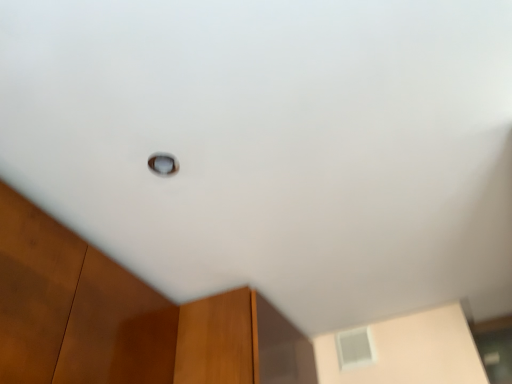
Image resolution: width=512 pixels, height=384 pixels. Identify the location of white frosted glass window at upper center, placed as the first window when sorted from bottom to top. (354, 348).

Describe the element at coordinates (354, 348) in the screenshot. The height and width of the screenshot is (384, 512). I see `white frosted glass window at upper center, the first window in the back-to-front sequence` at that location.

Find the location of a particular element. The image size is (512, 384). transparent glass window at center, the second window when ordered from bottom to top is located at coordinates (163, 164).

Describe the element at coordinates (163, 164) in the screenshot. This screenshot has width=512, height=384. I see `transparent glass window at center, arranged as the 1th window when viewed from the left` at that location.

This screenshot has height=384, width=512. I want to click on white frosted glass window at upper center, the first window in the back-to-front sequence, so click(x=354, y=348).

Can you confirm if white frosted glass window at upper center, the second window when ordered from front to back, is positioned to the left of transparent glass window at center, placed as the first window when sorted from top to bottom?

Incorrect, white frosted glass window at upper center, the second window when ordered from front to back, is not on the left side of transparent glass window at center, placed as the first window when sorted from top to bottom.

Considering the positions of objects white frosted glass window at upper center, the first window in the back-to-front sequence, and transparent glass window at center, which ranks as the second window in back-to-front order, in the image provided, who is behind, white frosted glass window at upper center, the first window in the back-to-front sequence, or transparent glass window at center, which ranks as the second window in back-to-front order,?

white frosted glass window at upper center, the first window in the back-to-front sequence, is further away from the camera.

Does point (358, 348) lie behind point (164, 157)?

Yes, it is.

From the image's perspective, which is above, white frosted glass window at upper center, the second window in the left-to-right sequence, or transparent glass window at center, which ranks as the second window in right-to-left order?

transparent glass window at center, which ranks as the second window in right-to-left order.

From a real-world perspective, is white frosted glass window at upper center, the second window when ordered from front to back, on transparent glass window at center, which ranks as the second window in back-to-front order?

Incorrect, from a real-world perspective, white frosted glass window at upper center, the second window when ordered from front to back, is lower than transparent glass window at center, which ranks as the second window in back-to-front order.

Which of these two, white frosted glass window at upper center, placed as the second window when sorted from top to bottom, or transparent glass window at center, which ranks as the second window in back-to-front order, is thinner?

transparent glass window at center, which ranks as the second window in back-to-front order, is thinner.

Who is shorter, white frosted glass window at upper center, the first window in the back-to-front sequence, or transparent glass window at center, the second window when ordered from bottom to top?

transparent glass window at center, the second window when ordered from bottom to top, is shorter.

Which of these two, white frosted glass window at upper center, the second window in the left-to-right sequence, or transparent glass window at center, which ranks as the second window in right-to-left order, is smaller?

transparent glass window at center, which ranks as the second window in right-to-left order, is smaller.

Is white frosted glass window at upper center, placed as the first window when sorted from bottom to top, positioned beyond the bounds of transparent glass window at center, which ranks as the second window in back-to-front order?

Indeed, white frosted glass window at upper center, placed as the first window when sorted from bottom to top, is completely outside transparent glass window at center, which ranks as the second window in back-to-front order.

Are white frosted glass window at upper center, the first window in the back-to-front sequence, and transparent glass window at center, arranged as the 1th window when viewed from the left, beside each other?

No, white frosted glass window at upper center, the first window in the back-to-front sequence, is not next to transparent glass window at center, arranged as the 1th window when viewed from the left.

Is transparent glass window at center, arranged as the 1th window when viewed from the left, at the back of white frosted glass window at upper center, acting as the first window starting from the right?

That's not correct — white frosted glass window at upper center, acting as the first window starting from the right, is not looking away from transparent glass window at center, arranged as the 1th window when viewed from the left.

How many degrees apart are the facing directions of white frosted glass window at upper center, the first window in the back-to-front sequence, and transparent glass window at center, which ranks as the second window in right-to-left order?

They differ by 1.97 degrees in their facing directions.

At what (x,y) coordinates should I click in order to perform the action: click on window lying above the white frosted glass window at upper center, placed as the first window when sorted from bottom to top (from the image's perspective). Please return your answer as a coordinate pair (x, y). The width and height of the screenshot is (512, 384). Looking at the image, I should click on (163, 164).

Considering the positions of objects transparent glass window at center, arranged as the 1th window when viewed from the left, and white frosted glass window at upper center, the second window in the left-to-right sequence, in the image provided, who is more to the left, transparent glass window at center, arranged as the 1th window when viewed from the left, or white frosted glass window at upper center, the second window in the left-to-right sequence,?

transparent glass window at center, arranged as the 1th window when viewed from the left, is more to the left.

Which object is closer to the camera taking this photo, transparent glass window at center, the second window when ordered from bottom to top, or white frosted glass window at upper center, placed as the first window when sorted from bottom to top?

transparent glass window at center, the second window when ordered from bottom to top, is in front.

Does point (162, 168) lie in front of point (362, 339)?

Yes, point (162, 168) is in front of point (362, 339).

From the image's perspective, which one is positioned higher, transparent glass window at center, arranged as the 1th window when viewed from the left, or white frosted glass window at upper center, placed as the first window when sorted from bottom to top?

transparent glass window at center, arranged as the 1th window when viewed from the left, from the image's perspective.

From a real-world perspective, which object stands above the other?

From a 3D spatial view, transparent glass window at center, which ranks as the second window in back-to-front order, is above.

Considering the sizes of transparent glass window at center, which ranks as the second window in back-to-front order, and white frosted glass window at upper center, placed as the second window when sorted from top to bottom, in the image, is transparent glass window at center, which ranks as the second window in back-to-front order, wider or thinner than white frosted glass window at upper center, placed as the second window when sorted from top to bottom,?

In the image, transparent glass window at center, which ranks as the second window in back-to-front order, appears to be more narrow than white frosted glass window at upper center, placed as the second window when sorted from top to bottom.

Between transparent glass window at center, arranged as the 1th window when viewed from the left, and white frosted glass window at upper center, the second window when ordered from front to back, which one has less height?

Standing shorter between the two is transparent glass window at center, arranged as the 1th window when viewed from the left.

Based on their sizes in the image, would you say transparent glass window at center, placed as the first window when sorted from top to bottom, is bigger or smaller than white frosted glass window at upper center, placed as the second window when sorted from top to bottom?

Clearly, transparent glass window at center, placed as the first window when sorted from top to bottom, is smaller in size than white frosted glass window at upper center, placed as the second window when sorted from top to bottom.

Is transparent glass window at center, which ranks as the second window in right-to-left order, outside of white frosted glass window at upper center, the first window in the back-to-front sequence?

That's correct, transparent glass window at center, which ranks as the second window in right-to-left order, is outside of white frosted glass window at upper center, the first window in the back-to-front sequence.

Is transparent glass window at center, which ranks as the second window in right-to-left order, next to white frosted glass window at upper center, acting as the first window starting from the right?

No, transparent glass window at center, which ranks as the second window in right-to-left order, is not in contact with white frosted glass window at upper center, acting as the first window starting from the right.

Is transparent glass window at center, arranged as the 1th window when viewed from the left, oriented towards white frosted glass window at upper center, placed as the second window when sorted from top to bottom?

No, transparent glass window at center, arranged as the 1th window when viewed from the left, does not turn towards white frosted glass window at upper center, placed as the second window when sorted from top to bottom.

What's the angular difference between transparent glass window at center, placed as the first window when sorted from top to bottom, and white frosted glass window at upper center, acting as the first window starting from the right,'s facing directions?

1.97 degrees separate the facing orientations of transparent glass window at center, placed as the first window when sorted from top to bottom, and white frosted glass window at upper center, acting as the first window starting from the right.

How much distance is there between transparent glass window at center, acting as the 1th window starting from the front, and white frosted glass window at upper center, placed as the first window when sorted from bottom to top?

They are 1.24 meters apart.

Where is `window behind the transparent glass window at center, placed as the first window when sorted from top to bottom`? window behind the transparent glass window at center, placed as the first window when sorted from top to bottom is located at coordinates (354, 348).

This screenshot has height=384, width=512. Identify the location of window above the white frosted glass window at upper center, the first window in the back-to-front sequence (from a real-world perspective). (163, 164).

This screenshot has width=512, height=384. What are the coordinates of `window behind the transparent glass window at center, which ranks as the second window in right-to-left order` in the screenshot? It's located at (354, 348).